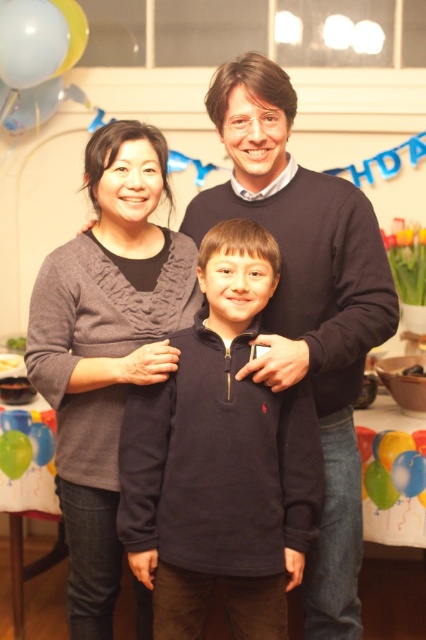
Question: Which of the following is the closest to the observer?

Choices:
 (A) (278, 170)
 (B) (259, 636)
 (C) (111, 502)

Answer: (B)

Question: Which of the following is the closest to the observer?

Choices:
 (A) (244, 564)
 (B) (78, 570)

Answer: (A)

Question: Is dark blue sweater at center positioned behind knitted gray sweater at center?

Choices:
 (A) yes
 (B) no

Answer: (B)

Question: Does dark blue sweater at center appear under knitted gray sweater at center?

Choices:
 (A) yes
 (B) no

Answer: (B)

Question: Which point is closer to the camera taking this photo?

Choices:
 (A) (365, 298)
 (B) (60, 445)
 (C) (250, 452)

Answer: (C)

Question: Is dark blue fleece at center positioned behind knitted gray sweater at center?

Choices:
 (A) yes
 (B) no

Answer: (B)